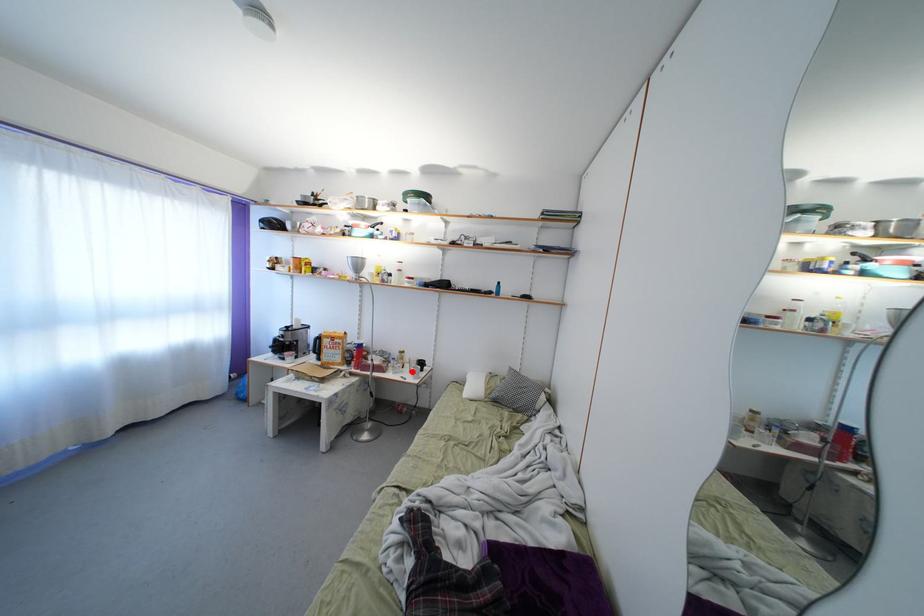
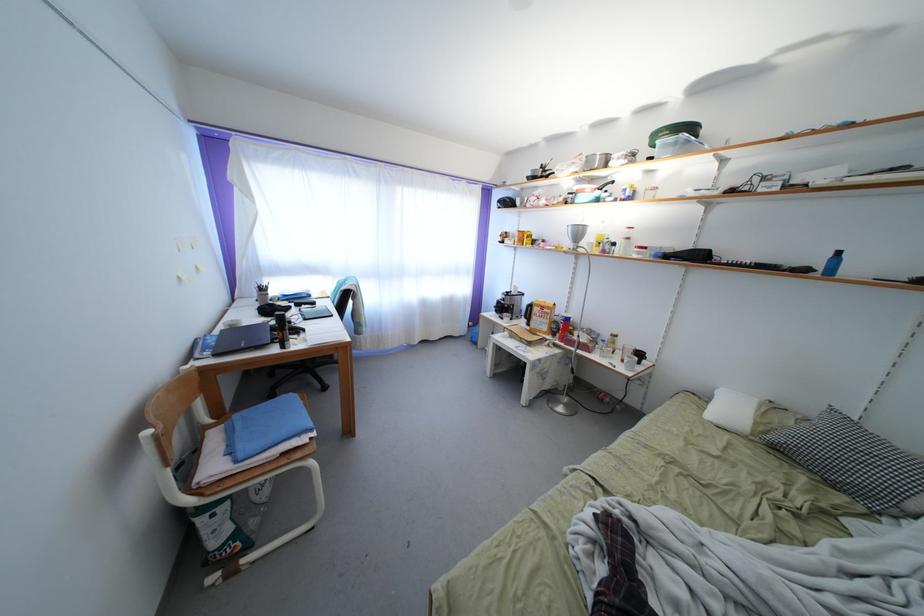
Find the pixel in the second image that matches the highlighted location in the first image.

(624, 359)